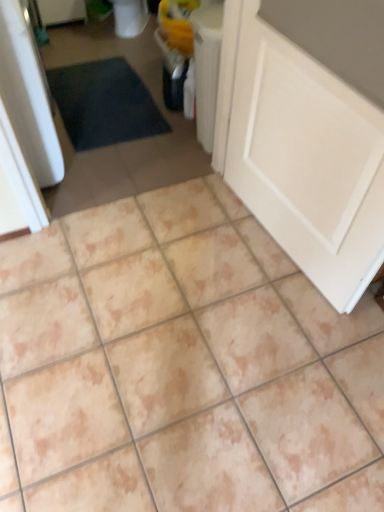
I want to click on free spot below white matte door at lower right (from a real-world perspective), so click(x=276, y=246).